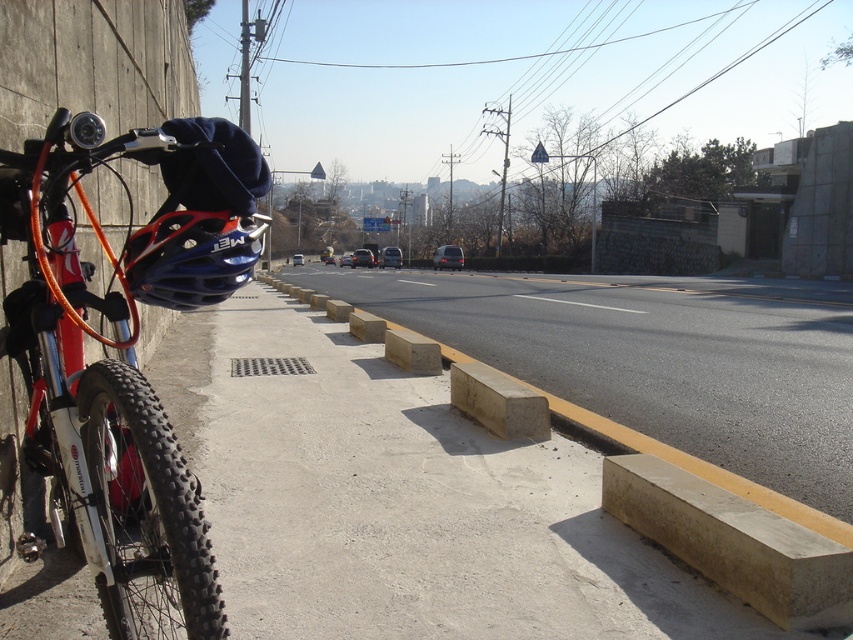
You are standing at the point with coordinates (x=401, y=500) in the image. What object are you currently standing on?

The point at coordinates (x=401, y=500) corresponds to concrete at left, so you are standing on the concrete wall where the bicycle is leaning against.